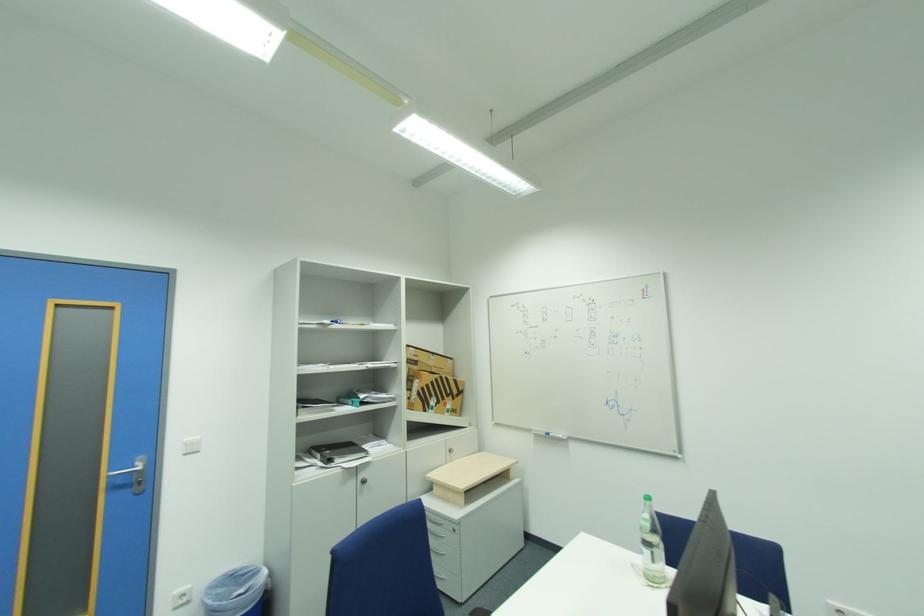
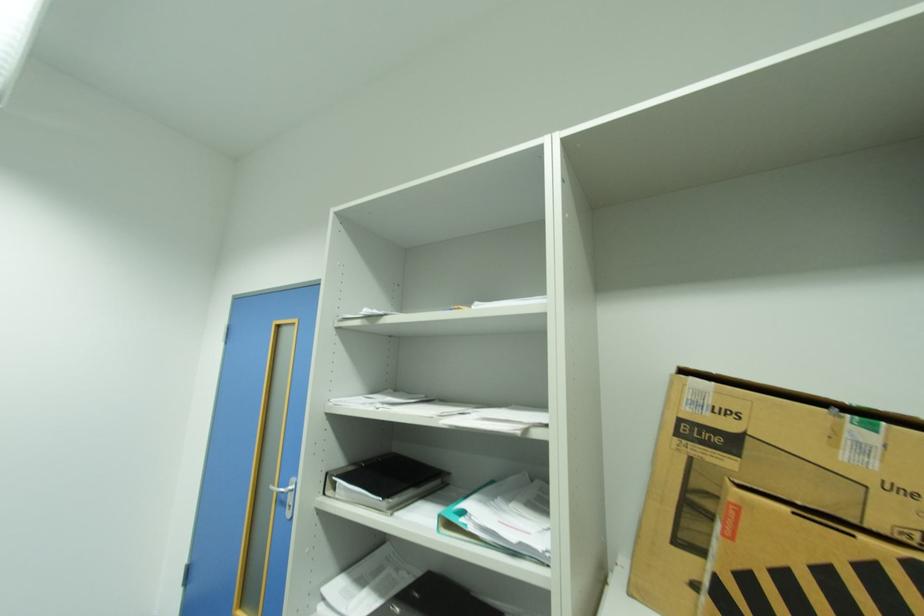
In the second image, find the point that corresponds to point 417,376 in the first image.

(700, 487)